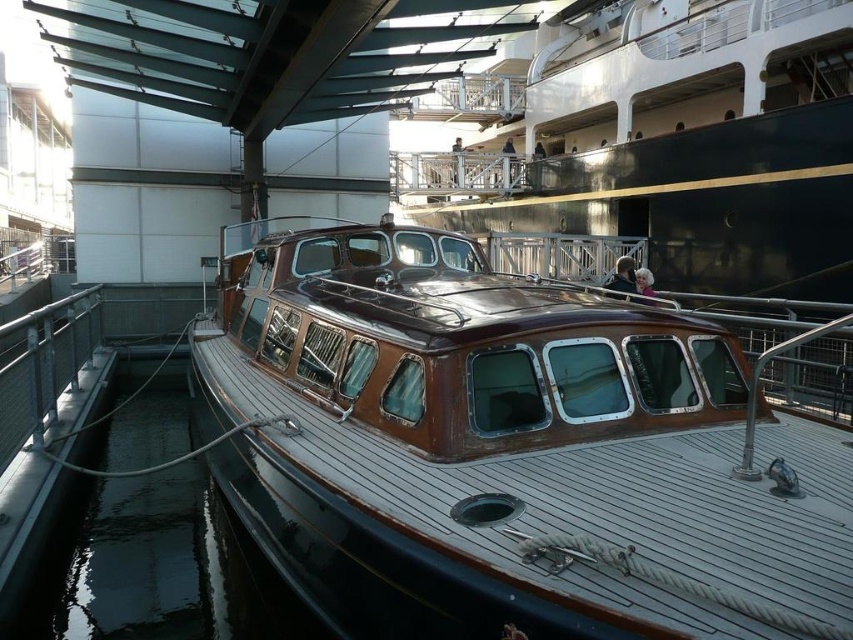
Question: Which of the following is the farthest from the observer?

Choices:
 (A) (291, 605)
 (B) (842, 529)

Answer: (A)

Question: Does wooden boat at center appear under black glossy water at lower left?

Choices:
 (A) yes
 (B) no

Answer: (B)

Question: Which of the following is the closest to the observer?

Choices:
 (A) (164, 472)
 (B) (293, 252)

Answer: (B)

Question: Can you confirm if wooden boat at center is positioned above black glossy water at lower left?

Choices:
 (A) no
 (B) yes

Answer: (B)

Question: Which object is closer to the camera taking this photo?

Choices:
 (A) black glossy water at lower left
 (B) wooden boat at center

Answer: (B)

Question: Can you confirm if wooden boat at center is thinner than black glossy water at lower left?

Choices:
 (A) yes
 (B) no

Answer: (B)